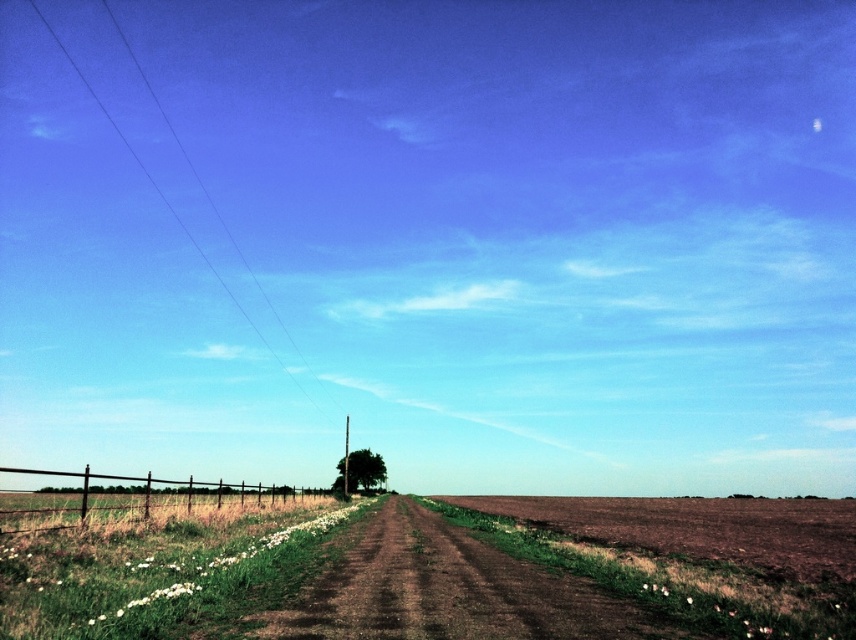
Measure the distance from brown soil at center to brown wooden fence at left.

A distance of 34.70 meters exists between brown soil at center and brown wooden fence at left.

Who is shorter, brown soil at center or brown wooden fence at left?

With less height is brown soil at center.

Who is more distant from viewer, (846, 602) or (46, 499)?

Point (46, 499)

At what (x,y) coordinates should I click in order to perform the action: click on brown soil at center. Please return your answer as a coordinate pair (x, y). This screenshot has height=640, width=856. Looking at the image, I should click on (681, 572).

Does brown dirt track at center appear under brown soil at center?

No.

Is brown dirt track at center closer to camera compared to brown soil at center?

Yes.

The width and height of the screenshot is (856, 640). What do you see at coordinates (449, 589) in the screenshot? I see `brown dirt track at center` at bounding box center [449, 589].

Locate an element on the screen. This screenshot has height=640, width=856. brown dirt track at center is located at coordinates (449, 589).

Can you confirm if brown wooden fence at left is positioned to the right of green leafy tree at center?

No, brown wooden fence at left is not to the right of green leafy tree at center.

The height and width of the screenshot is (640, 856). I want to click on brown wooden fence at left, so click(135, 499).

Where is `brown wooden fence at left`? brown wooden fence at left is located at coordinates (135, 499).